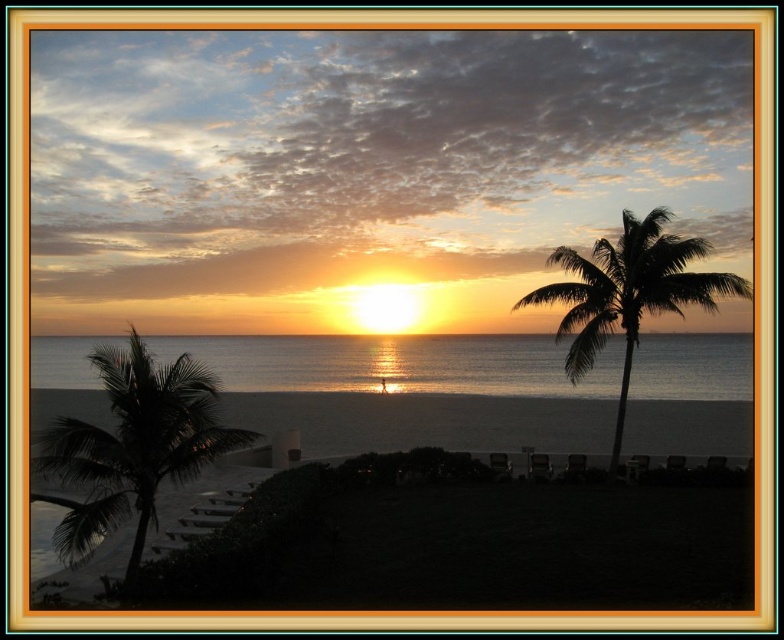
Question: Among these objects, which one is farthest from the camera?

Choices:
 (A) silvery reflective water at center
 (B) white sand beach at center
 (C) silhouette leafy palm at right
 (D) green leafy palm tree at lower left

Answer: (A)

Question: Does green leafy palm tree at lower left have a greater width compared to silhouette leafy palm at right?

Choices:
 (A) yes
 (B) no

Answer: (B)

Question: Is white sand beach at center bigger than silhouette leafy palm at right?

Choices:
 (A) no
 (B) yes

Answer: (A)

Question: Is silvery reflective water at center thinner than silhouette leafy palm at right?

Choices:
 (A) no
 (B) yes

Answer: (A)

Question: Which point is closer to the camera?

Choices:
 (A) (503, 451)
 (B) (167, 378)
 (C) (737, 348)
 (D) (714, 294)

Answer: (B)

Question: Which point is closer to the camera taking this photo?

Choices:
 (A) (659, 588)
 (B) (220, 422)
 (C) (314, 381)

Answer: (A)